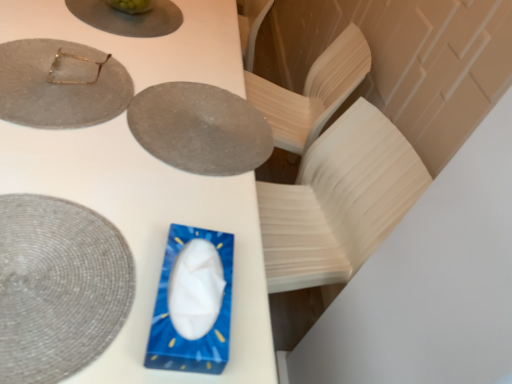
In order to click on vacant area located to the right-hand side of gold metallic glasses at upper left in this screenshot , I will do `click(156, 97)`.